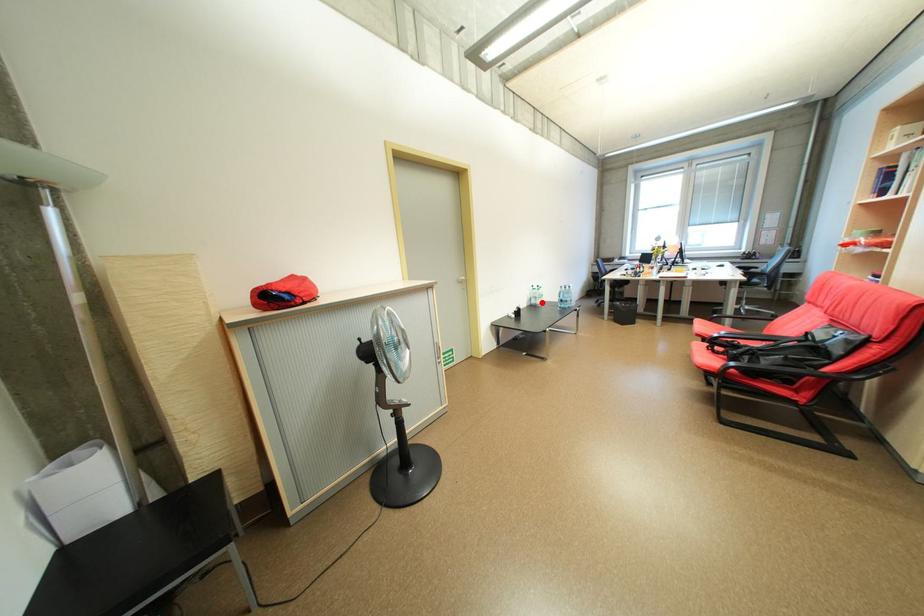
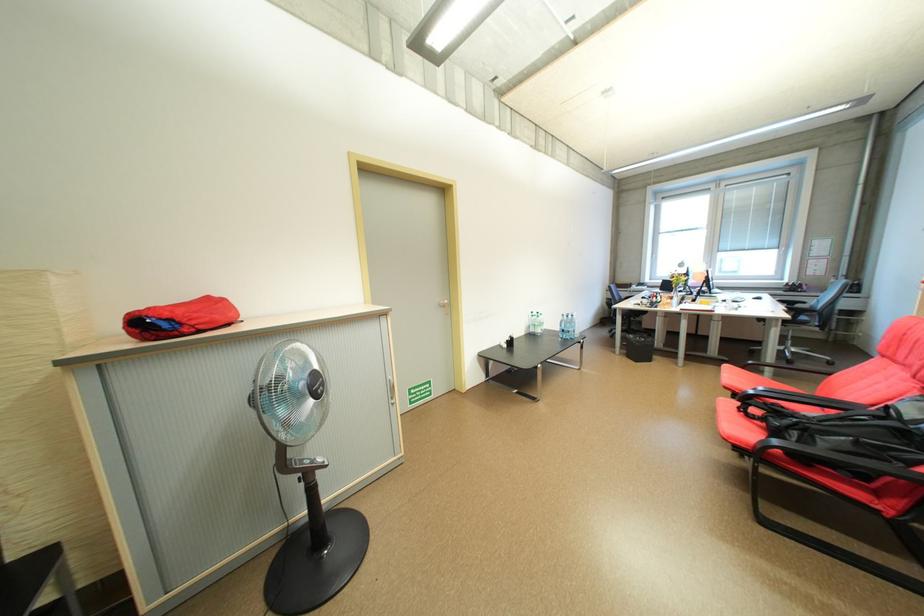
Find the pixel in the second image that matches the highlighted location in the first image.

(541, 331)